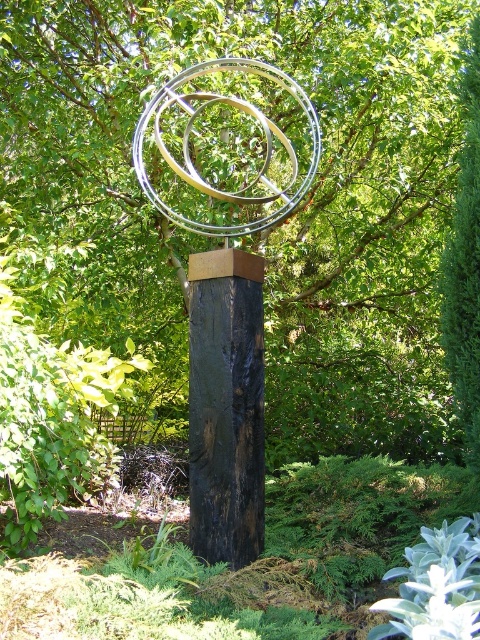
Question: Does metallic rings at center come in front of black wood post at center?

Choices:
 (A) no
 (B) yes

Answer: (B)

Question: Which object appears farthest from the camera in this image?

Choices:
 (A) green leafy tree at center
 (B) black wood post at center

Answer: (A)

Question: Among these points, which one is farthest from the camera?

Choices:
 (A) (325, 422)
 (B) (292, 164)
 (C) (230, 516)

Answer: (A)

Question: Considering the relative positions of metallic rings at center and polished silver rings at center in the image provided, where is metallic rings at center located with respect to polished silver rings at center?

Choices:
 (A) right
 (B) left

Answer: (A)

Question: Which point is closer to the camera?

Choices:
 (A) black wood post at center
 (B) green leafy tree at center

Answer: (A)

Question: Considering the relative positions of green leafy tree at center and metallic rings at center in the image provided, where is green leafy tree at center located with respect to metallic rings at center?

Choices:
 (A) left
 (B) right

Answer: (B)